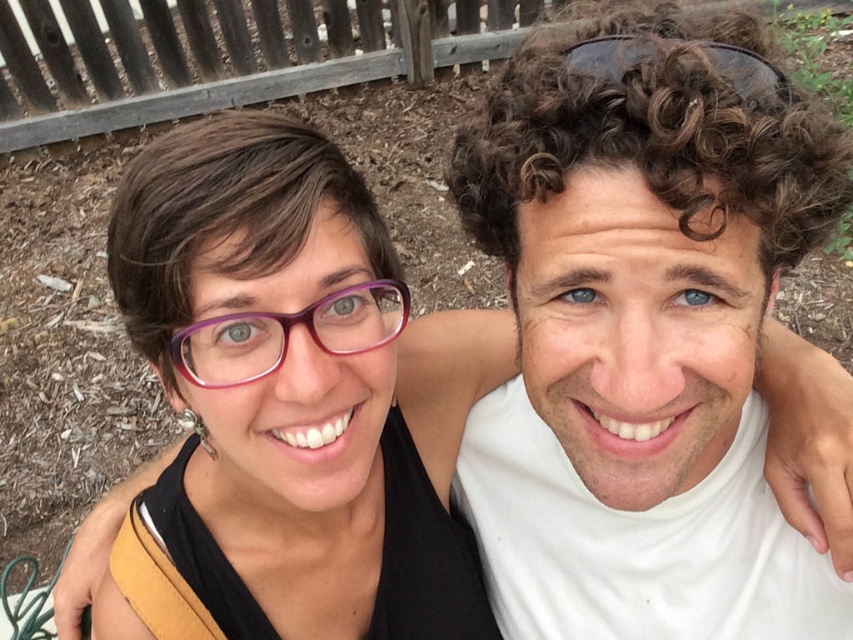
Question: Is matte black tank top at center to the right of sunglasses at upper center from the viewer's perspective?

Choices:
 (A) no
 (B) yes

Answer: (A)

Question: Does matte black tank top at center have a smaller size compared to sunglasses at upper center?

Choices:
 (A) no
 (B) yes

Answer: (A)

Question: Is matte black tank top at center to the left of purple acetate glasses at center from the viewer's perspective?

Choices:
 (A) yes
 (B) no

Answer: (A)

Question: Which point is farther to the camera?

Choices:
 (A) (291, 324)
 (B) (260, 324)
 (C) (757, 61)

Answer: (B)

Question: Which point is closer to the camera?

Choices:
 (A) coord(302,321)
 (B) coord(129,545)
 (C) coord(583,64)

Answer: (C)

Question: Among these objects, which one is nearest to the camera?

Choices:
 (A) matte black tank top at center
 (B) sunglasses at upper center

Answer: (B)